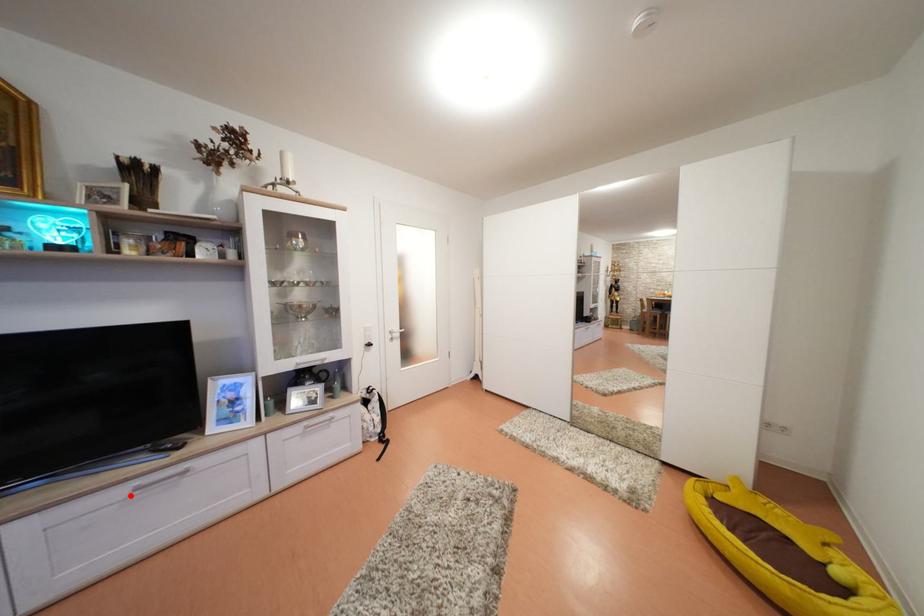
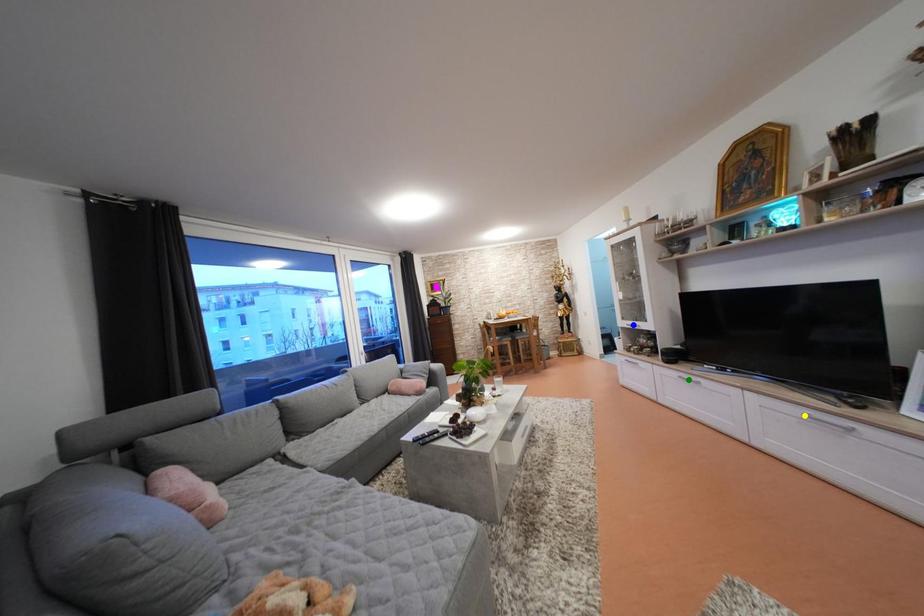
Question: I am providing you with two images of the same scene from different viewpoints. A red point is marked on the first image. You are given multiple points on the second image. Which point in image 2 represents the same 3d spot as the red point in image 1?

Choices:
 (A) yellow point
 (B) green point
 (C) blue point

Answer: (A)